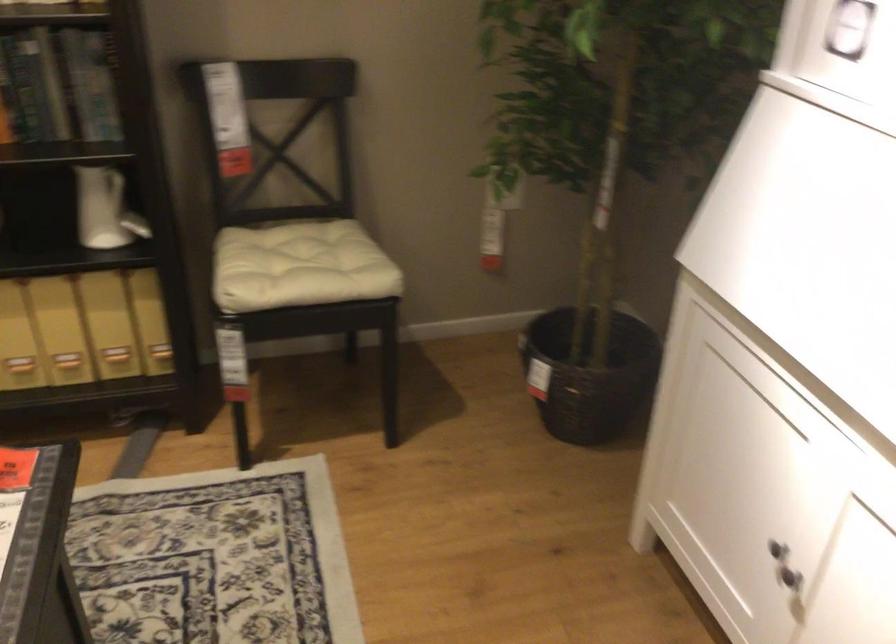
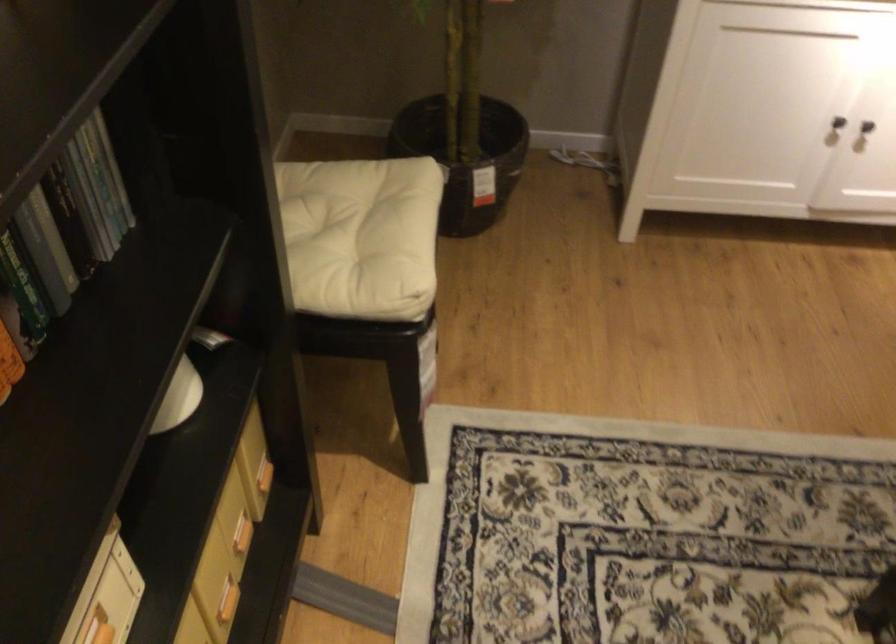
Find the pixel in the second image that matches (99,109) in the first image.

(95, 198)